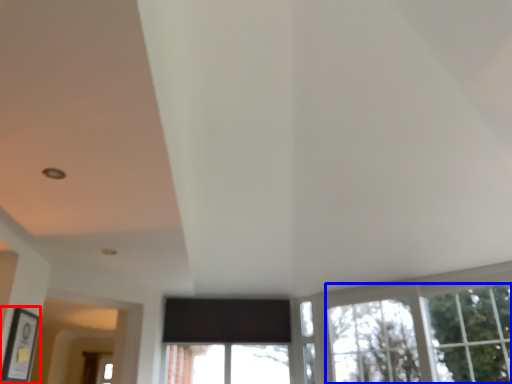
Question: Which object appears closest to the camera in this image, picture frame (highlighted by a red box) or tree (highlighted by a blue box)?

Choices:
 (A) picture frame
 (B) tree

Answer: (A)